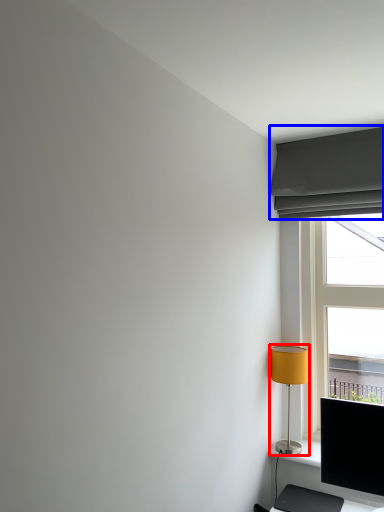
Question: Which of the following is the closest to the observer, lamp (highlighted by a red box) or curtain (highlighted by a blue box)?

Choices:
 (A) lamp
 (B) curtain

Answer: (B)